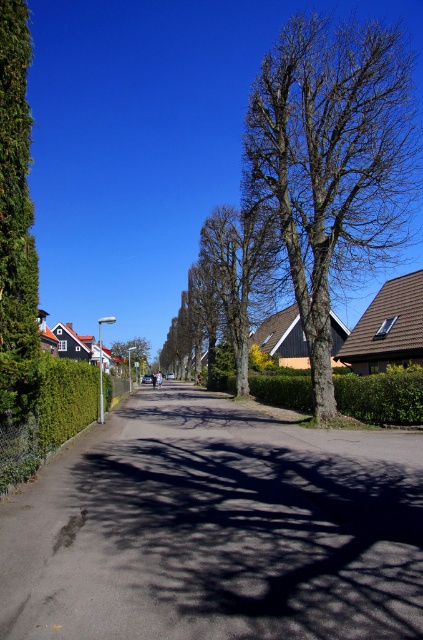
You are standing at the point marked by the coordinates point (49, 417) on the left side of the street. What object is located at that point?

The point (49, 417) marks the green hedge at left.